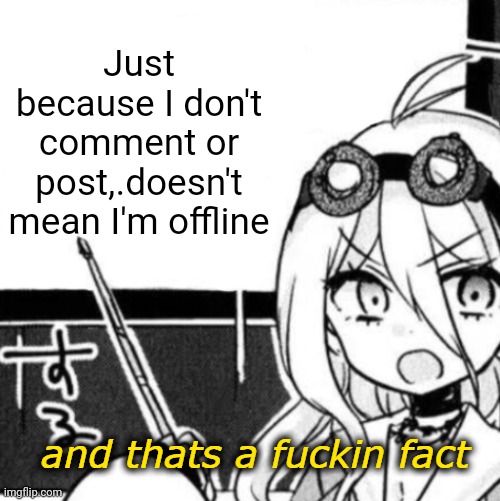
Where is `white board`? Image resolution: width=500 pixels, height=501 pixels. white board is located at coordinates (290, 122).